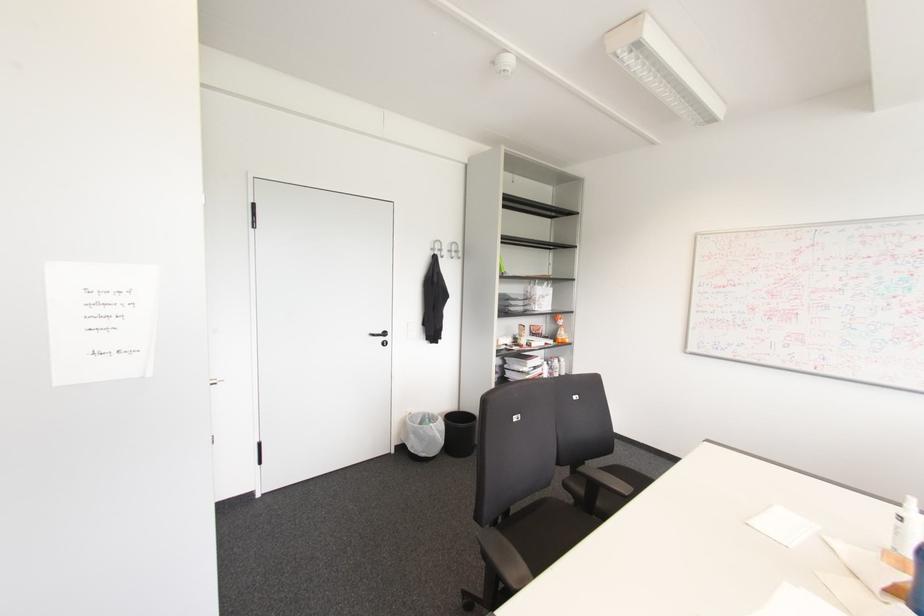
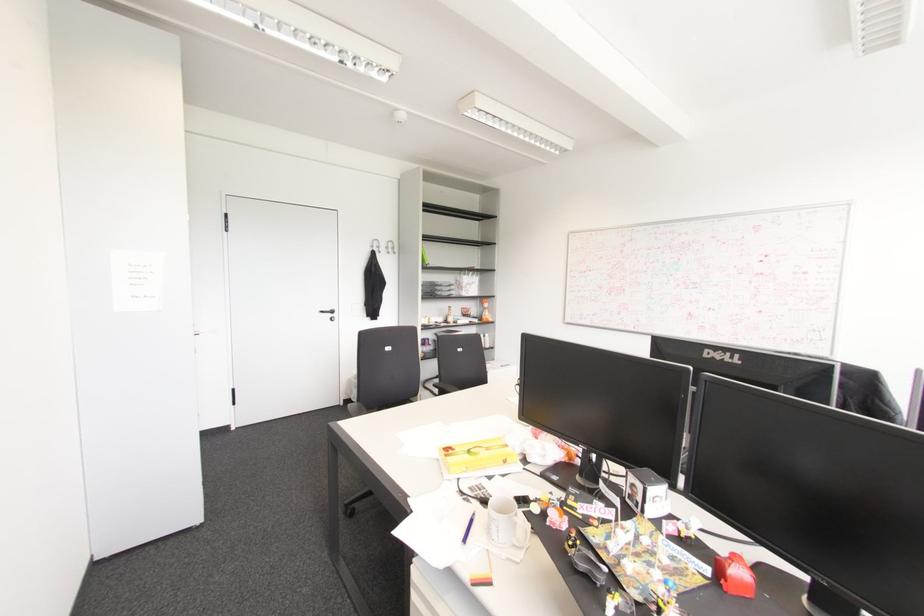
Find the pixel in the second image that matches point 560,322 in the first image.

(485, 305)